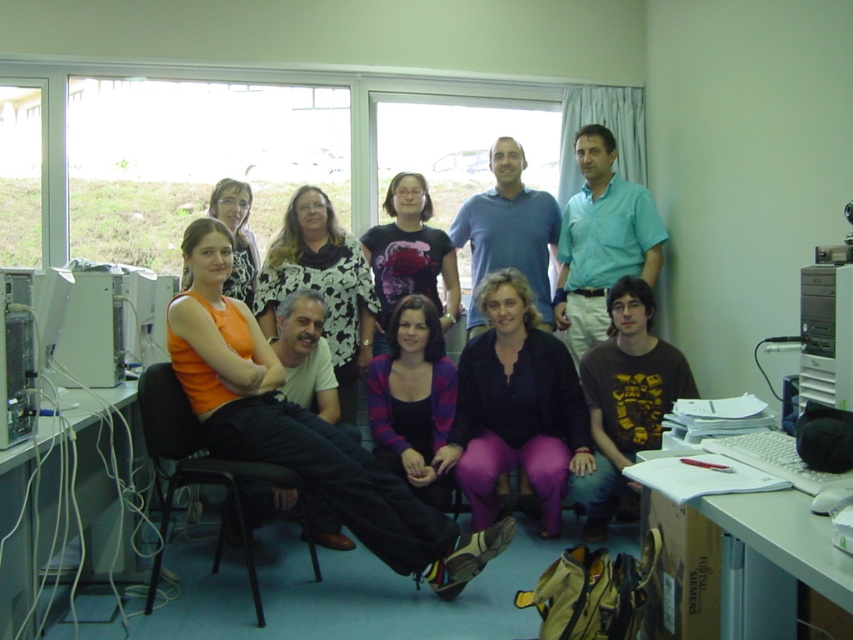
Question: Considering the real-world distances, which object is farthest from the purple matte pants at center?

Choices:
 (A) blue cotton shirt at center
 (B) black metal chair at center
 (C) silver metallic tower at right
 (D) light blue shirt at center

Answer: (C)

Question: Is the position of orange matte tank top at center more distant than that of purple matte pants at center?

Choices:
 (A) yes
 (B) no

Answer: (B)

Question: Does orange matte tank top at center appear over light blue shirt at center?

Choices:
 (A) no
 (B) yes

Answer: (A)

Question: Which of these objects is positioned closest to the orange fabric top at center?

Choices:
 (A) dark brown t-shirt at center
 (B) matte black shirt at center
 (C) black metal chair at center
 (D) orange matte tank top at center

Answer: (B)

Question: Which object appears closest to the camera in this image?

Choices:
 (A) orange fabric top at center
 (B) purple matte pants at center
 (C) black metal chair at center

Answer: (C)

Question: Is striped sweater at center positioned in front of black metal chair at center?

Choices:
 (A) no
 (B) yes

Answer: (A)